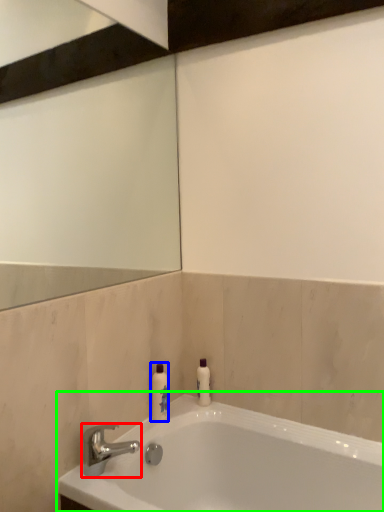
Question: Which object is the closest to the tap (highlighted by a red box)? Choose among these: toiletry (highlighted by a blue box) or bathtub (highlighted by a green box).

Choices:
 (A) toiletry
 (B) bathtub

Answer: (A)